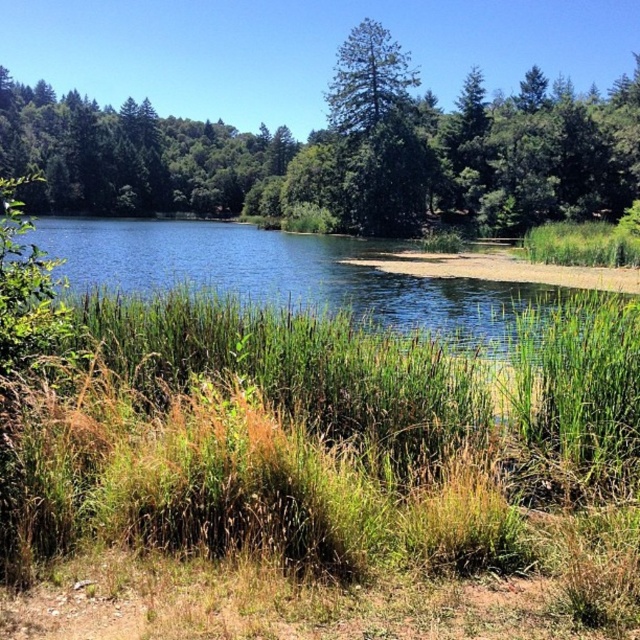
Question: Which of the following is the farthest from the observer?

Choices:
 (A) brown sandy shore at lower center
 (B) green grassy at lower center
 (C) green textured tree at center

Answer: (C)

Question: Estimate the real-world distances between objects in this image. Which object is closer to the green textured tree at center?

Choices:
 (A) green grassy at lower center
 (B) blue water at center

Answer: (B)

Question: Observing the image, what is the correct spatial positioning of green textured tree at center in reference to blue water at center?

Choices:
 (A) above
 (B) below

Answer: (A)

Question: Is green grassy at lower center to the right of green textured tree at center from the viewer's perspective?

Choices:
 (A) yes
 (B) no

Answer: (A)

Question: Which point is farther from the camera taking this photo?

Choices:
 (A) (195, 339)
 (B) (260, 292)

Answer: (B)

Question: Is blue water at center further to camera compared to brown sandy shore at lower center?

Choices:
 (A) yes
 (B) no

Answer: (B)